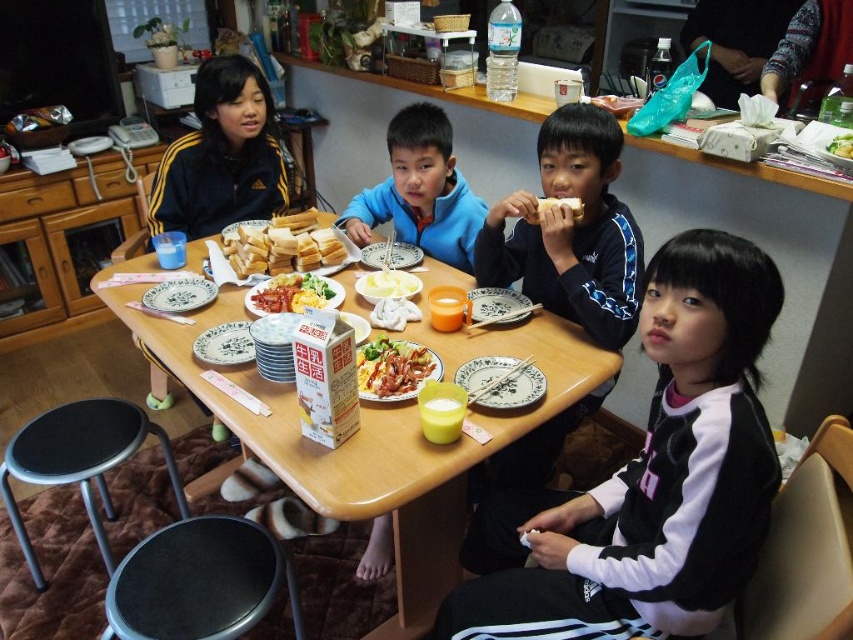
Between white bread at center and yellow scrambled eggs at center, which one appears on the right side from the viewer's perspective?

yellow scrambled eggs at center is more to the right.

Does white bread at center appear under yellow scrambled eggs at center?

No.

Does point (280, 216) lie in front of point (308, 289)?

No.

Image resolution: width=853 pixels, height=640 pixels. Identify the location of white bread at center. (283, 244).

Is blue fleece jacket at center taller than shiny plastic bacon at center?

Correct, blue fleece jacket at center is much taller as shiny plastic bacon at center.

Is point (439, 109) positioned in front of point (410, 362)?

No, it is not.

This screenshot has height=640, width=853. What do you see at coordinates (421, 192) in the screenshot?
I see `blue fleece jacket at center` at bounding box center [421, 192].

Identify the location of blue fleece jacket at center. The width and height of the screenshot is (853, 640). (421, 192).

Between point (181, 508) and point (560, 204), which one is positioned behind?

The point (181, 508) is more distant.

Is black rubber stool at lower left to the right of white bread at upper center from the viewer's perspective?

No, black rubber stool at lower left is not to the right of white bread at upper center.

What do you see at coordinates (80, 461) in the screenshot? The image size is (853, 640). I see `black rubber stool at lower left` at bounding box center [80, 461].

This screenshot has height=640, width=853. I want to click on black rubber stool at lower left, so click(x=80, y=461).